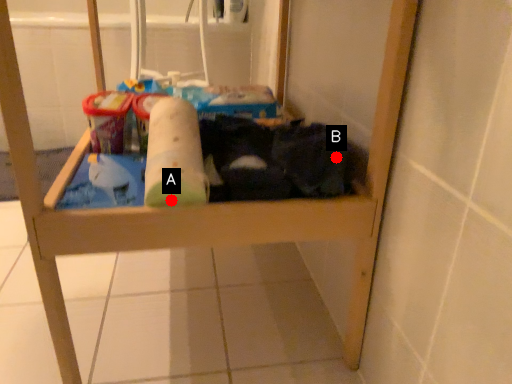
Question: Two points are circled on the image, labeled by A and B beside each circle. Which point is farther from the camera taking this photo?

Choices:
 (A) A is further
 (B) B is further

Answer: (B)